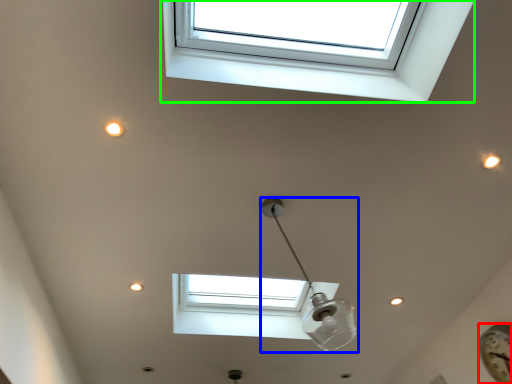
Question: Which object is positioned farthest from clock (highlighted by a red box)? Select from lamp (highlighted by a blue box) and window (highlighted by a green box).

Choices:
 (A) lamp
 (B) window

Answer: (B)